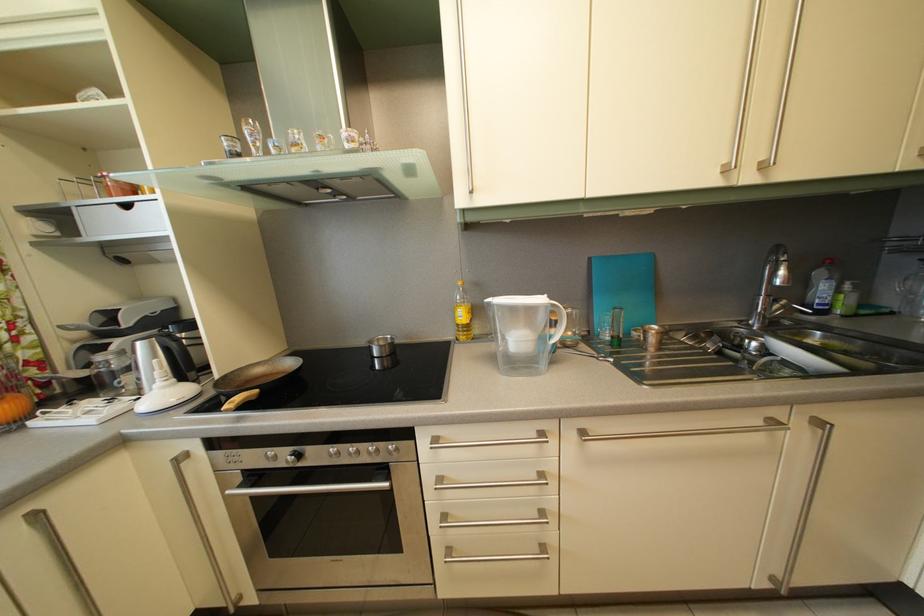
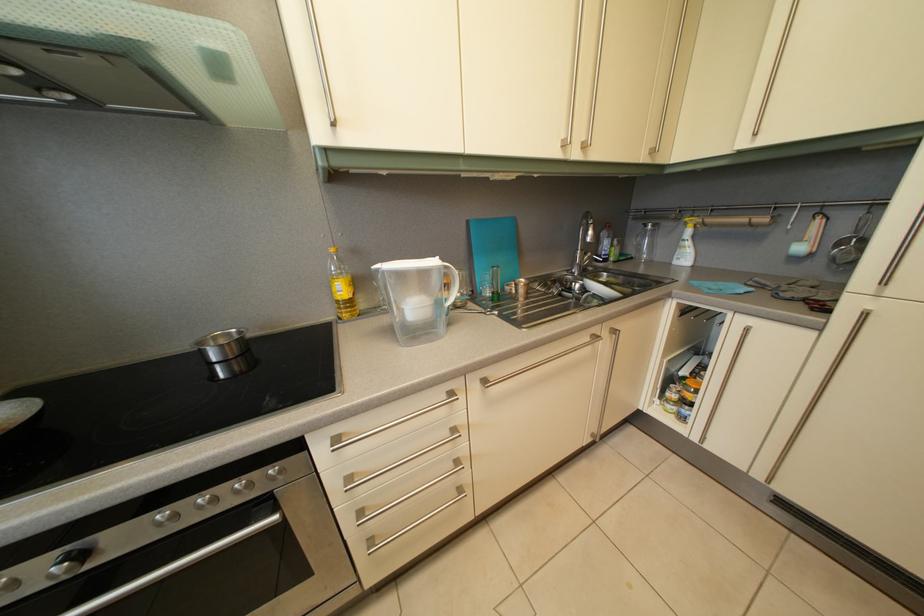
Question: I am providing you with two images of the same scene from different viewpoints. Which of the following objects are not visible in image2?

Choices:
 (A) white pitcher handle
 (B) silver oven knob
 (C) metal cabinet handle
 (D) none of these

Answer: (D)